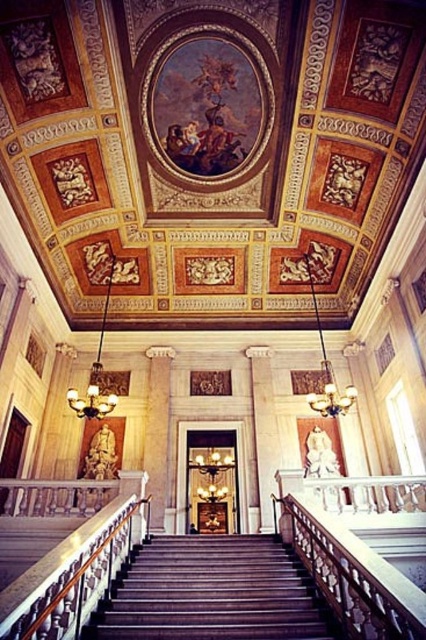
Does wooden staircase at center come in front of white marble column at center?

Yes, wooden staircase at center is in front of white marble column at center.

Between wooden staircase at center and white marble column at center, which one is positioned higher?

white marble column at center is above.

Does point (210, 588) come behind point (160, 486)?

No, (210, 588) is in front of (160, 486).

At what (x,y) coordinates should I click in order to perform the action: click on wooden staircase at center. Please return your answer as a coordinate pair (x, y). The width and height of the screenshot is (426, 640). Looking at the image, I should click on (213, 593).

Who is more forward, (120, 548) or (161, 397)?

Positioned in front is point (120, 548).

In the scene shown: Measure the distance between white marble railing at center and white marble column at center.

They are 26.02 feet apart.

Which is in front, point (89, 600) or point (161, 380)?

Point (89, 600) is in front.

At what (x,y) coordinates should I click in order to perform the action: click on white marble railing at center. Please return your answer as a coordinate pair (x, y). The width and height of the screenshot is (426, 640). Looking at the image, I should click on [x=74, y=573].

This screenshot has width=426, height=640. Describe the element at coordinates (213, 593) in the screenshot. I see `wooden staircase at center` at that location.

Which is in front, point (216, 580) or point (124, 513)?

Point (216, 580) is in front.

Where is `wooden staircase at center`? The height and width of the screenshot is (640, 426). wooden staircase at center is located at coordinates [x=213, y=593].

At what (x,y) coordinates should I click in order to perform the action: click on wooden staircase at center. Please return your answer as a coordinate pair (x, y). Looking at the image, I should click on (213, 593).